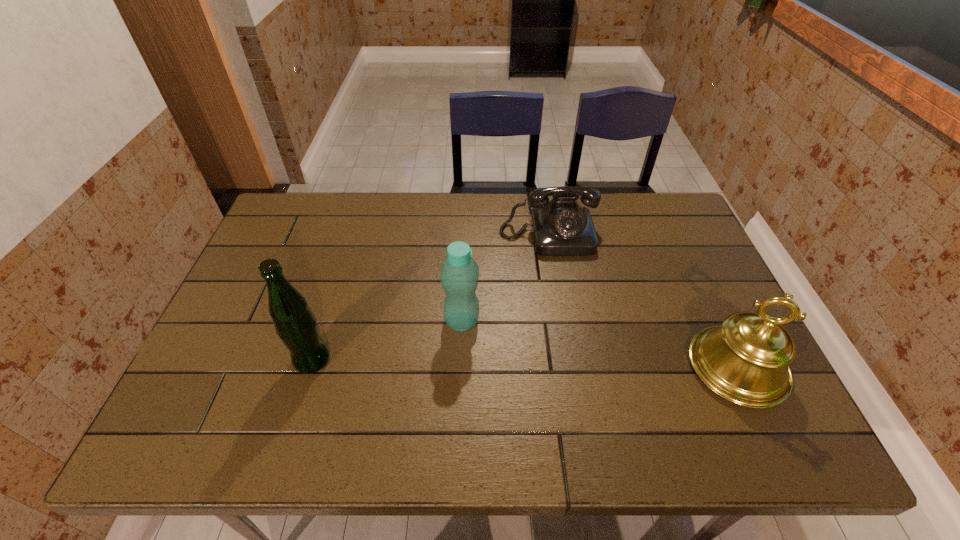
Where is `the leftmost object`? The height and width of the screenshot is (540, 960). the leftmost object is located at coordinates (295, 324).

At what (x,y) coordinates should I click in order to perform the action: click on the tallest object. Please return your answer as a coordinate pair (x, y). The height and width of the screenshot is (540, 960). Looking at the image, I should click on (295, 324).

I want to click on the rightmost object, so click(x=745, y=360).

Image resolution: width=960 pixels, height=540 pixels. I want to click on the farthest object, so click(x=561, y=227).

The width and height of the screenshot is (960, 540). Identify the location of telephone. 561,227.

I want to click on the third object from right to left, so click(459, 277).

The width and height of the screenshot is (960, 540). Identify the location of vacant space situated 0.240m on the right of the tallest object. (430, 360).

Locate an element on the screen. Image resolution: width=960 pixels, height=540 pixels. vacant space located 0.190m on the left of the rightmost object is located at coordinates (610, 367).

Where is `free space located 0.160m on the dial of the telephone`? The height and width of the screenshot is (540, 960). free space located 0.160m on the dial of the telephone is located at coordinates (560, 296).

You are a GUI agent. You are given a task and a screenshot of the screen. Output one action in this format:
    pyautogui.click(x=<x>, y=<y>)
    Task: Click on the vacant area situated 0.190m on the dial of the telephone
    This screenshot has width=960, height=540.
    Given the screenshot: What is the action you would take?
    pyautogui.click(x=562, y=305)